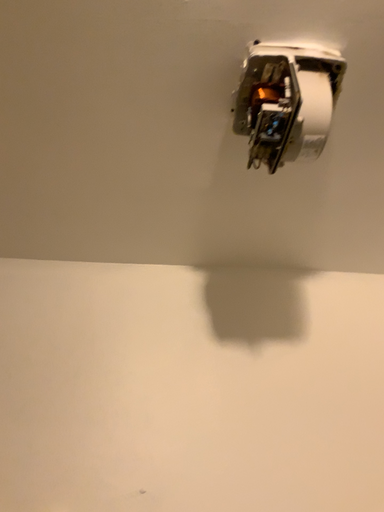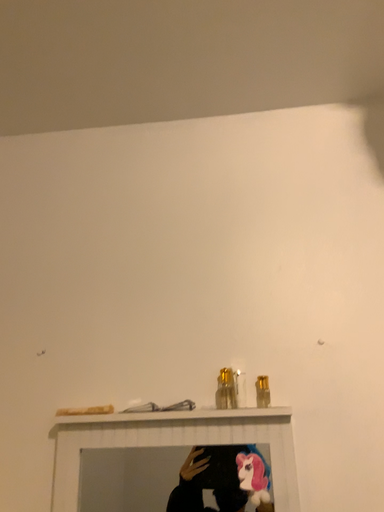
Question: Which way did the camera rotate in the video?

Choices:
 (A) rotated downward
 (B) rotated upward

Answer: (A)